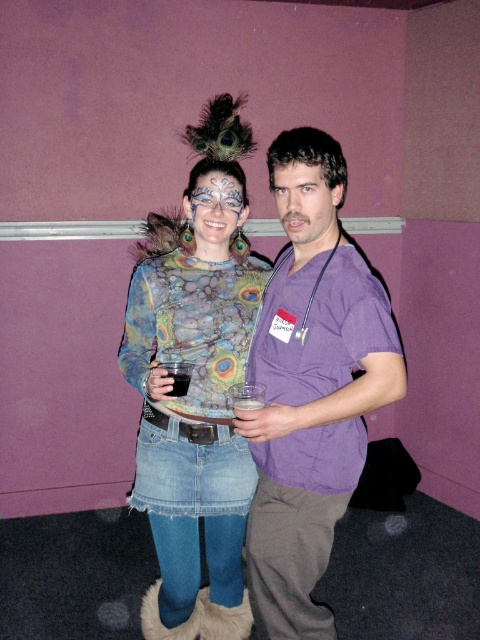
Question: Does textured peacock feather dress at center appear on the left side of matte peacock feather at center?

Choices:
 (A) yes
 (B) no

Answer: (A)

Question: Which of these objects is positioned closest to the smooth skin face at center?

Choices:
 (A) purple scrubs at center
 (B) textured peacock feather dress at center

Answer: (A)

Question: Can you confirm if purple scrubs at center is positioned to the left of matte peacock feather at center?

Choices:
 (A) no
 (B) yes

Answer: (A)

Question: Which of the following is the farthest from the observer?

Choices:
 (A) textured peacock feather dress at center
 (B) matte peacock feather at center
 (C) purple scrubs at center

Answer: (B)

Question: Does textured peacock feather dress at center appear over matte peacock feather at center?

Choices:
 (A) no
 (B) yes

Answer: (A)

Question: Which of the following is the farthest from the observer?

Choices:
 (A) (296, 458)
 (B) (190, 346)
 (C) (308, 236)
 (D) (197, 216)

Answer: (D)